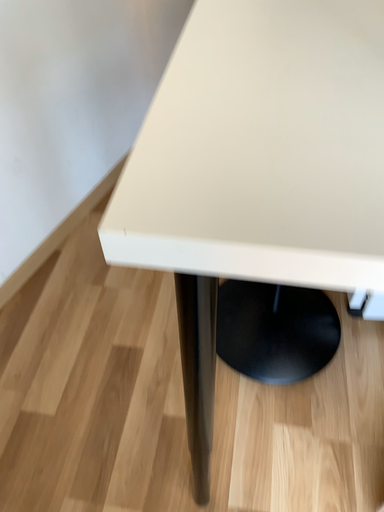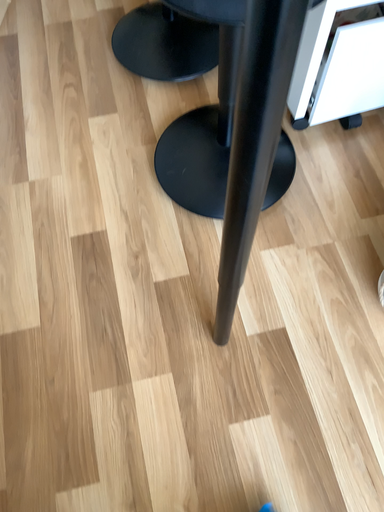
Question: How did the camera likely rotate when shooting the video?

Choices:
 (A) rotated downward
 (B) rotated upward

Answer: (A)